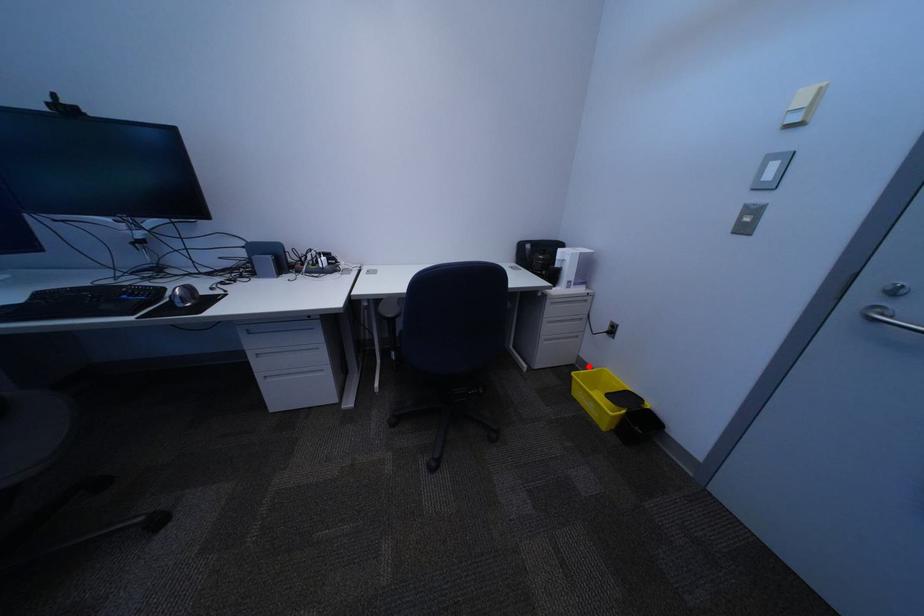
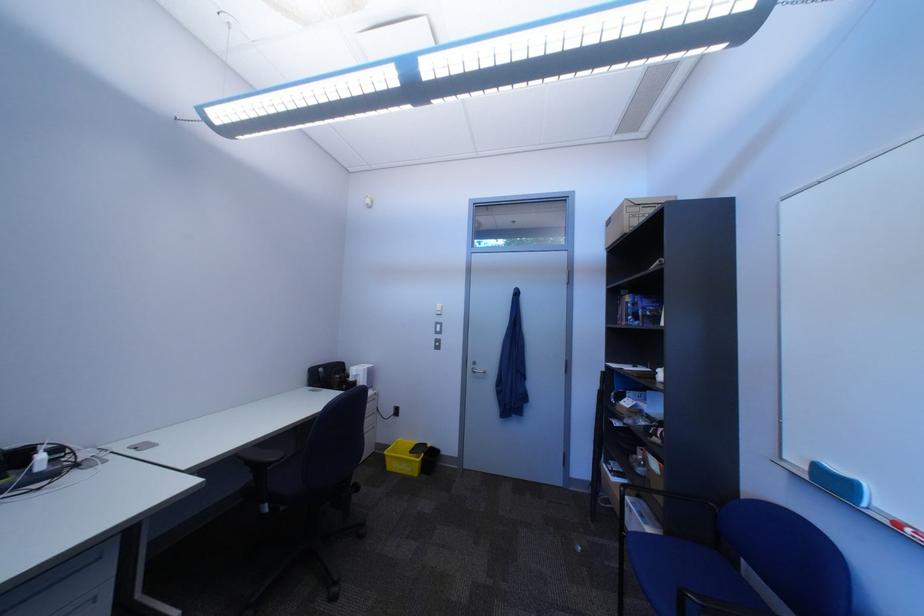
Locate, in the second image, the point that corresponds to the highlighted location in the first image.

(388, 454)